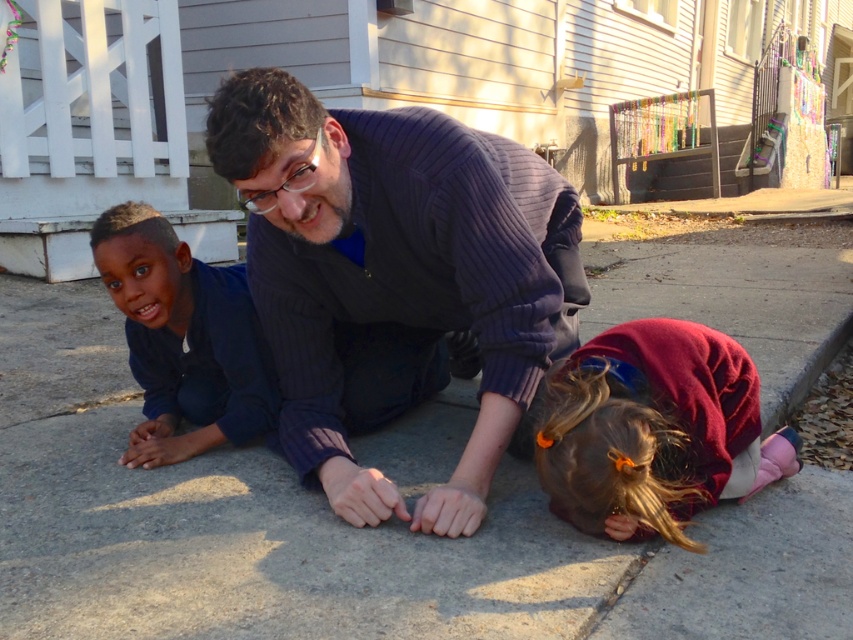
You are a delivery person trying to place a package on the gray concrete pavement at center and the maroon fleece jacket at lower right. Which surface is wider so the package won not fall off?

The gray concrete pavement at center is wider than the maroon fleece jacket at lower right, so placing the package there would be more stable.

You are a delivery robot with a 50 cm wide package. You need to navigate between the dark blue sweater at center and the smooth navy blue shirt at left. Can you fit through the space between them?

The distance between the dark blue sweater at center and the smooth navy blue shirt at left is 49.14 centimeters. Since the package is 50 cm wide, it is slightly wider than the available space. Therefore, the robot cannot fit through the space between them.

You are a delivery robot with a 3.5 feet wide package. You need to navigate through the space between the maroon fleece jacket at lower right and the smooth navy blue shirt at left. Can you fit through this space?

The distance between the maroon fleece jacket at lower right and the smooth navy blue shirt at left is 3.86 feet, which is wider than the 3.5 feet wide package. Therefore, the delivery robot can safely navigate through this space.